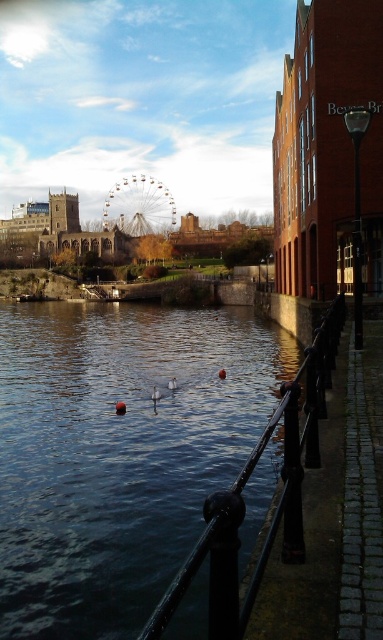
From the picture: You are standing on the cobblestone pathway near the black metal rail at lower center and want to take a photo of the metallic ferris wheel at center. Which direction should you face to ensure the ferris wheel is in the frame?

Since the black metal rail at lower center is below the metallic ferris wheel at center, you should look upward to capture the ferris wheel in your photo.

In the scene shown: You are standing at the edge of the riverside walkway and want to find the black metal rail at lower center. According to the scene description, where would you look relative to your position?

The black metal rail at lower center is located at point (243,502), so you should look towards the lower center area of the scene to find it.